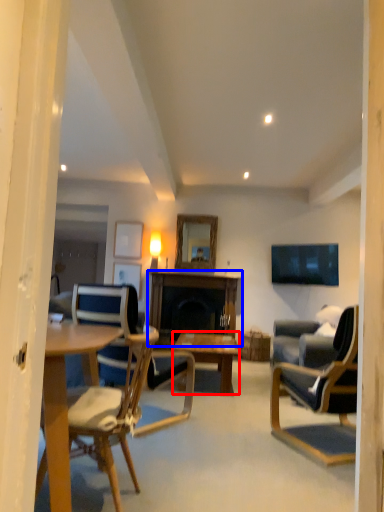
Question: Among these objects, which one is farthest to the camera, coffee table (highlighted by a red box) or table (highlighted by a blue box)?

Choices:
 (A) coffee table
 (B) table

Answer: (B)